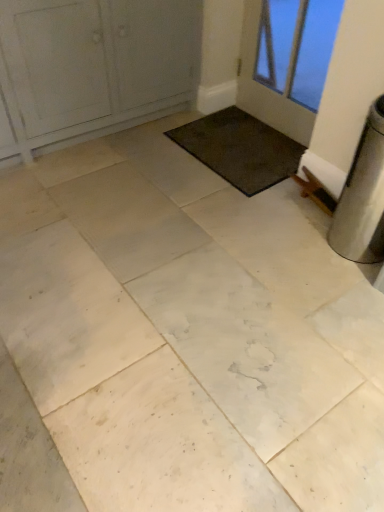
Question: Considering the positions of white painted wood door at upper left, the first door positioned from the left, and dark brown carpet at center in the image, is white painted wood door at upper left, the first door positioned from the left, wider or thinner than dark brown carpet at center?

Choices:
 (A) wide
 (B) thin

Answer: (A)

Question: From their relative heights in the image, would you say white painted wood door at upper left, acting as the 2th door starting from the right, is taller or shorter than dark brown carpet at center?

Choices:
 (A) short
 (B) tall

Answer: (B)

Question: Which object is positioned farthest from the white glass door at upper right, which is the 2th door in left-to-right order?

Choices:
 (A) dark brown carpet at center
 (B) white painted wood door at upper left, acting as the 2th door starting from the right

Answer: (B)

Question: Based on their relative distances, which object is farther from the dark brown carpet at center?

Choices:
 (A) white glass door at upper right, which is the 2th door in left-to-right order
 (B) white painted wood door at upper left, acting as the 2th door starting from the right

Answer: (A)